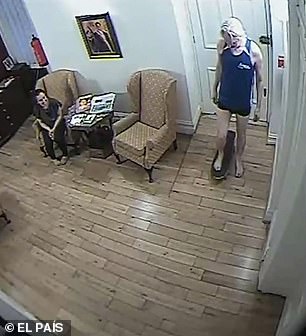
The width and height of the screenshot is (306, 336). I want to click on vacant chair, so click(149, 102).